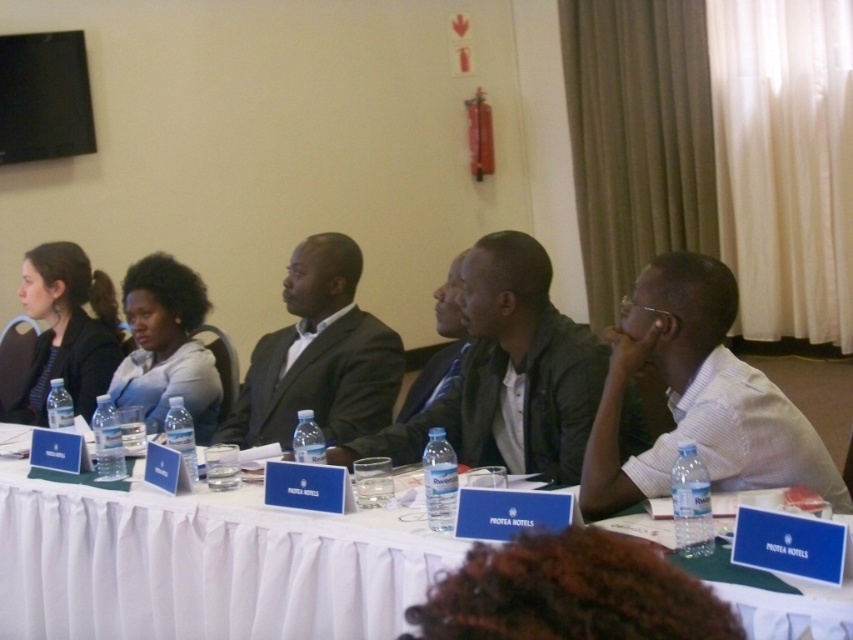
Question: Which object is farther from the camera taking this photo?

Choices:
 (A) white striped shirt at center
 (B) dark gray leather jacket at center

Answer: (B)

Question: Does white striped shirt at center have a lesser width compared to dark gray leather jacket at center?

Choices:
 (A) yes
 (B) no

Answer: (A)

Question: Where is white fabric table at center located in relation to dark gray leather jacket at center in the image?

Choices:
 (A) below
 (B) above

Answer: (A)

Question: Which object is farther from the camera taking this photo?

Choices:
 (A) dark gray leather jacket at center
 (B) matte black jacket at left
 (C) white fabric table at center
 (D) matte gray sweater at center

Answer: (B)

Question: Which of the following is the farthest from the observer?

Choices:
 (A) (198, 429)
 (B) (418, 436)

Answer: (A)

Question: Does dark gray leather jacket at center have a smaller size compared to black suit at center?

Choices:
 (A) no
 (B) yes

Answer: (A)